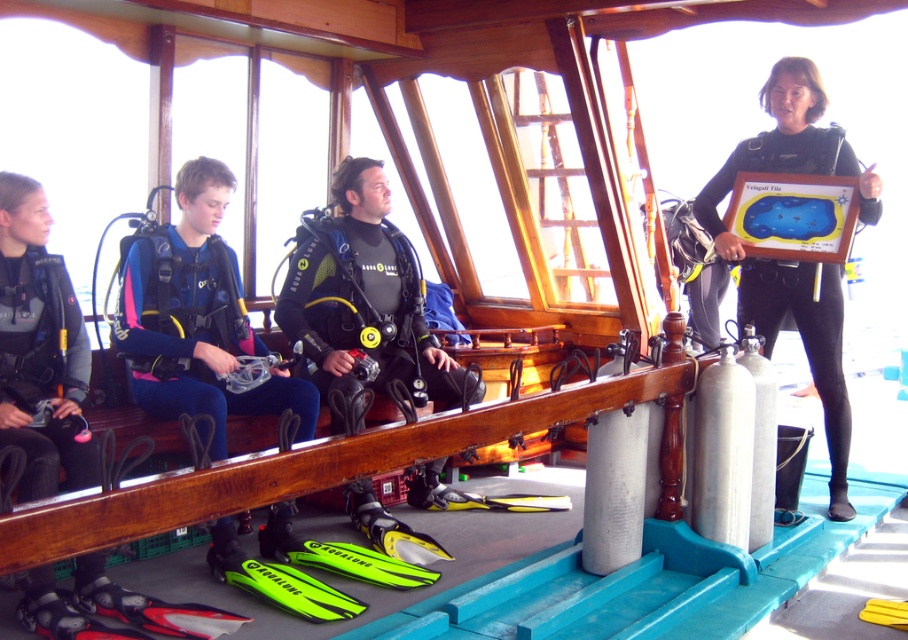
Does pink neoprene wetsuit at left appear on the left side of black matte wetsuit at right?

Correct, you'll find pink neoprene wetsuit at left to the left of black matte wetsuit at right.

Does pink neoprene wetsuit at left have a lesser width compared to black matte wetsuit at right?

In fact, pink neoprene wetsuit at left might be wider than black matte wetsuit at right.

In order to click on pink neoprene wetsuit at left in this screenshot , I will do `click(196, 317)`.

Can you confirm if matte black wetsuit at left is wider than black matte wetsuit at right?

No, matte black wetsuit at left is not wider than black matte wetsuit at right.

Between matte black wetsuit at left and black matte wetsuit at right, which one appears on the left side from the viewer's perspective?

From the viewer's perspective, matte black wetsuit at left appears more on the left side.

Who is more forward, (41, 241) or (704, 209)?

Point (41, 241) is in front.

Where is `matte black wetsuit at left`? matte black wetsuit at left is located at coordinates (40, 348).

Who is more distant from viewer, (192, 365) or (25, 618)?

The point (192, 365) is more distant.

Between pink neoprene wetsuit at left and matte black wetsuit at left, which one appears on the left side from the viewer's perspective?

matte black wetsuit at left

Find the location of a particular element. This screenshot has width=908, height=640. pink neoprene wetsuit at left is located at coordinates (196, 317).

Find the location of a particular element. This screenshot has height=640, width=908. pink neoprene wetsuit at left is located at coordinates point(196,317).